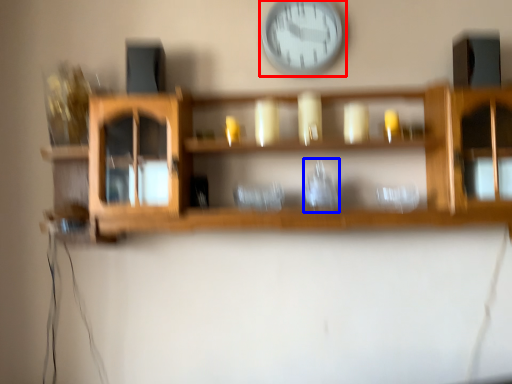
Question: Which object is closer to the camera taking this photo, wall clock (highlighted by a red box) or glass vase (highlighted by a blue box)?

Choices:
 (A) wall clock
 (B) glass vase

Answer: (B)